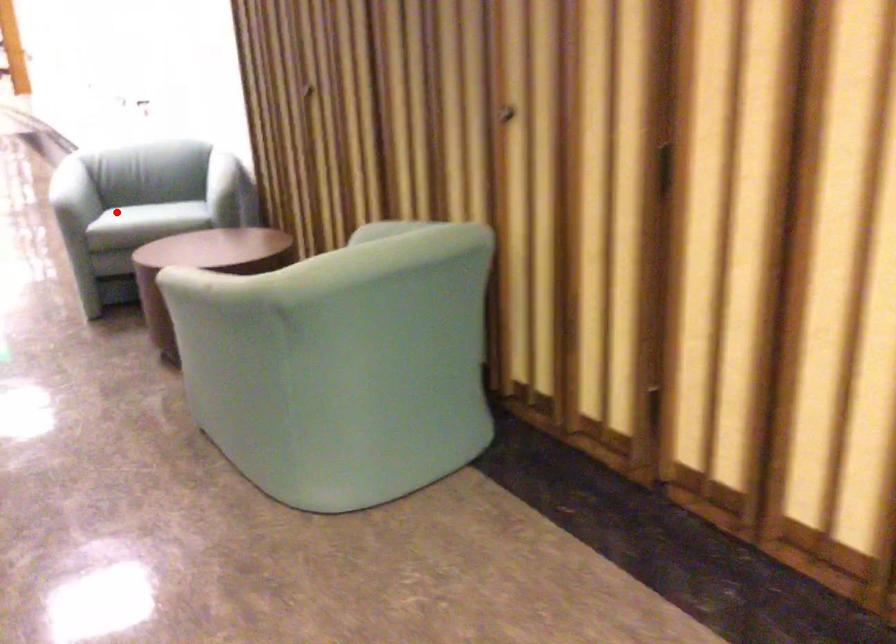
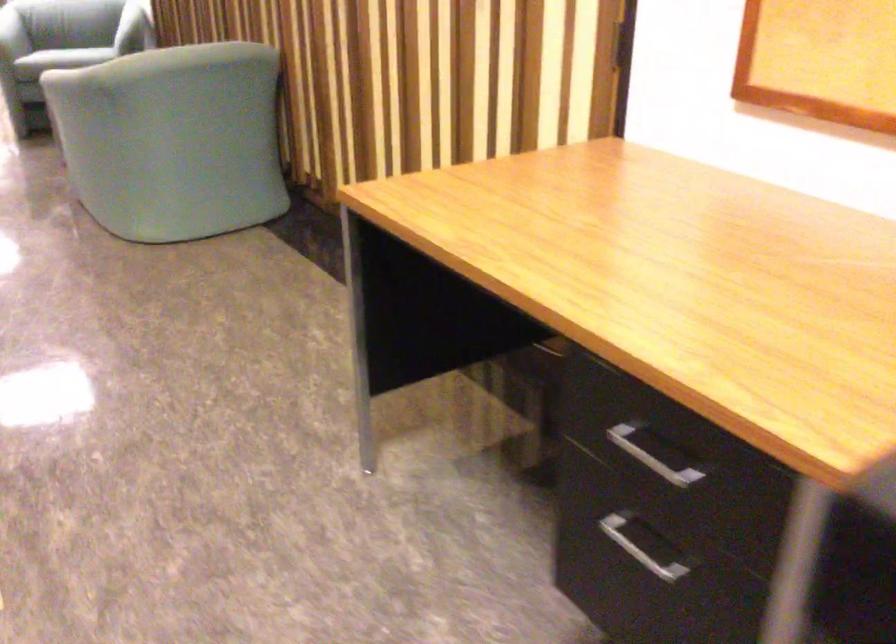
Question: I am providing you with two images of the same scene from different viewpoints. A red point is shown in image1. For the corresponding object point in image2, is it positioned nearer or farther from the camera?

Choices:
 (A) Nearer
 (B) Farther

Answer: (B)